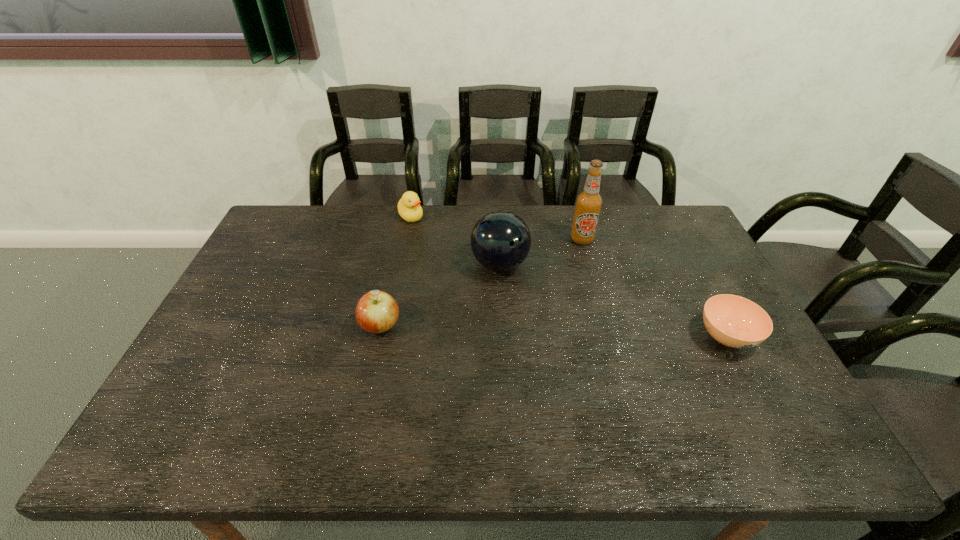
The height and width of the screenshot is (540, 960). What are the coordinates of `blank region between the rightmost object and the apple` in the screenshot? It's located at (554, 332).

In order to click on vacant area between the apple and the farthest object in this screenshot , I will do `click(396, 271)`.

Where is `free space that is in between the third object from right to left and the apple`? Image resolution: width=960 pixels, height=540 pixels. free space that is in between the third object from right to left and the apple is located at coordinates (441, 295).

Where is `free space between the soup bowl and the tallest object`? This screenshot has width=960, height=540. free space between the soup bowl and the tallest object is located at coordinates (655, 288).

I want to click on free space that is in between the third object from right to left and the farthest object, so click(x=455, y=240).

Identify the location of free area in between the third object from left to right and the apple. This screenshot has width=960, height=540. (441, 295).

Select which object appears as the fourth closest to the fourth shortest object. Please provide its 2D coordinates. Your answer should be formatted as a tuple, i.e. [(x, y)], where the tuple contains the x and y coordinates of a point satisfying the conditions above.

[(734, 321)]

Locate which object is the second closest to the fourth object from left to right. Please provide its 2D coordinates. Your answer should be formatted as a tuple, i.e. [(x, y)], where the tuple contains the x and y coordinates of a point satisfying the conditions above.

[(734, 321)]

The height and width of the screenshot is (540, 960). I want to click on vacant space that satisfies the following two spatial constraints: 1. on the front side of the duckling; 2. on the left side of the rightmost object, so click(x=387, y=336).

I want to click on free space that satisfies the following two spatial constraints: 1. on the front side of the duckling; 2. on the left side of the shortest object, so click(x=387, y=336).